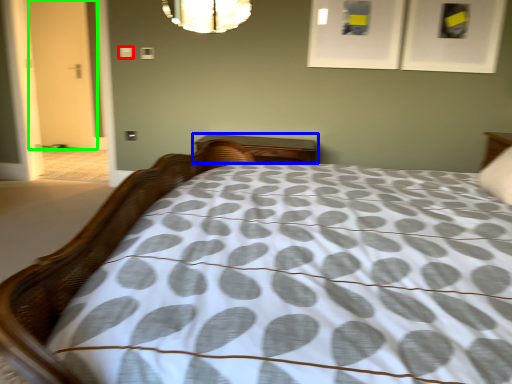
Question: Based on their relative distances, which object is farther from dot (highlighted by a red box)? Choose from nightstand (highlighted by a blue box) and door (highlighted by a green box).

Choices:
 (A) nightstand
 (B) door

Answer: (B)